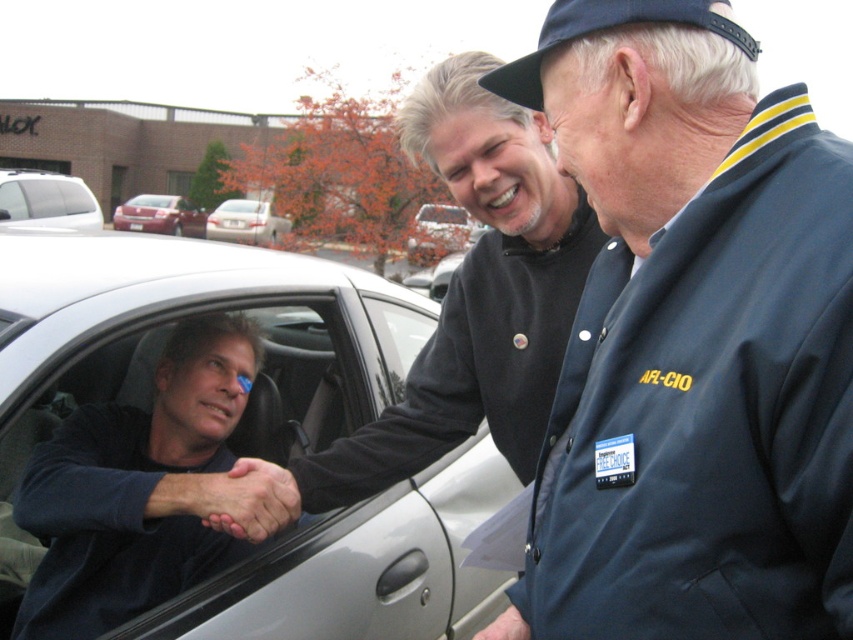
Question: Does matte black jacket at center appear over smooth skin handshake at center?

Choices:
 (A) yes
 (B) no

Answer: (A)

Question: Among these objects, which one is nearest to the camera?

Choices:
 (A) silver metallic van at left
 (B) metallic red sedan at left
 (C) dark blue shirt at left

Answer: (C)

Question: Is matte black jacket at center below metallic red sedan at left?

Choices:
 (A) yes
 (B) no

Answer: (A)

Question: Which object is closer to the camera taking this photo?

Choices:
 (A) silver metallic van at left
 (B) silver metallic car at center
 (C) smooth skin hand at center
 (D) white glossy sedan at center

Answer: (C)

Question: Is smooth skin handshake at center wider than smooth skin hand at center?

Choices:
 (A) no
 (B) yes

Answer: (B)

Question: Which point is farther to the camera?

Choices:
 (A) matte black jacket at center
 (B) metallic red sedan at left
 (C) white glossy sedan at center

Answer: (B)